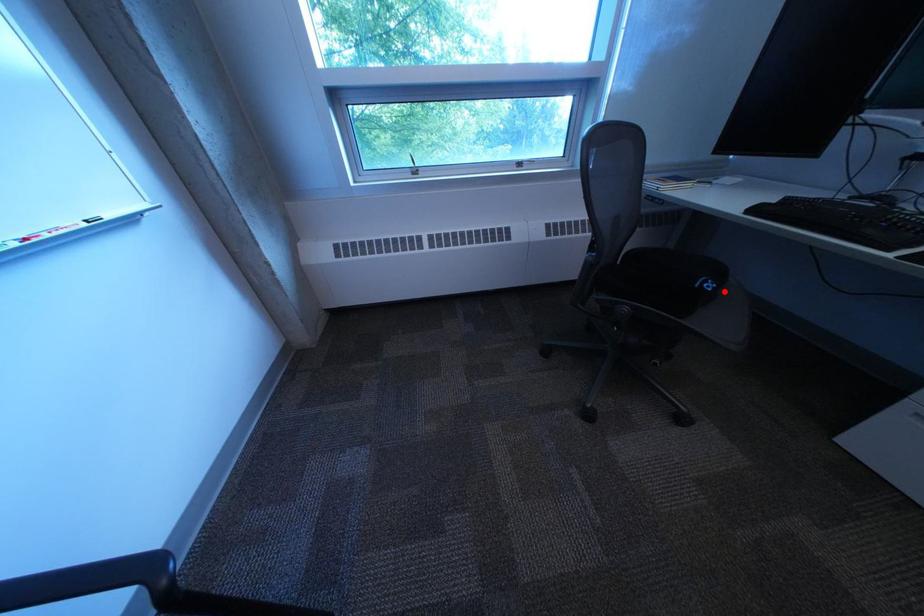
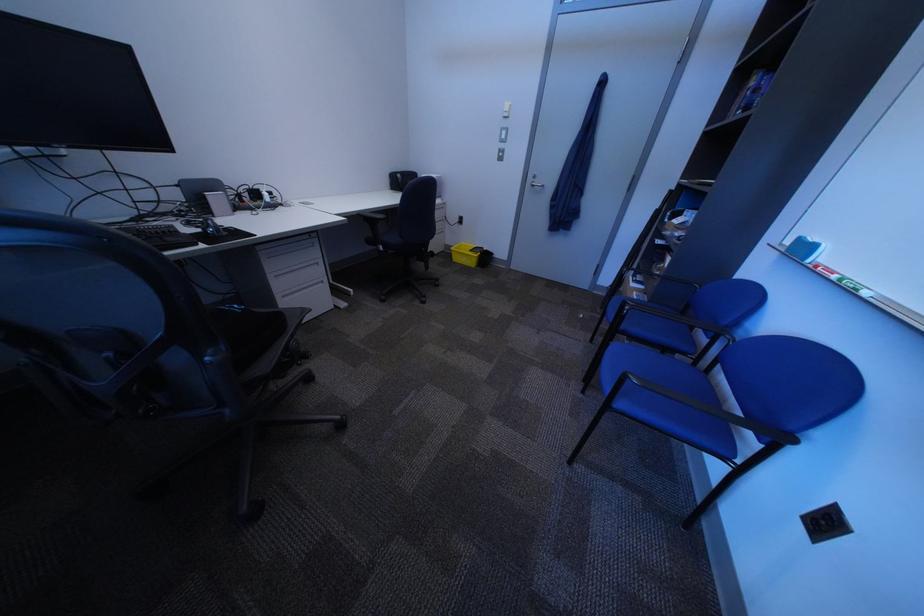
Question: I am providing you with two images of the same scene from different viewpoints. In image1, a red point is highlighted. Considering the same 3D point in image2, which of the following is correct?

Choices:
 (A) It is closer
 (B) It is farther

Answer: (A)